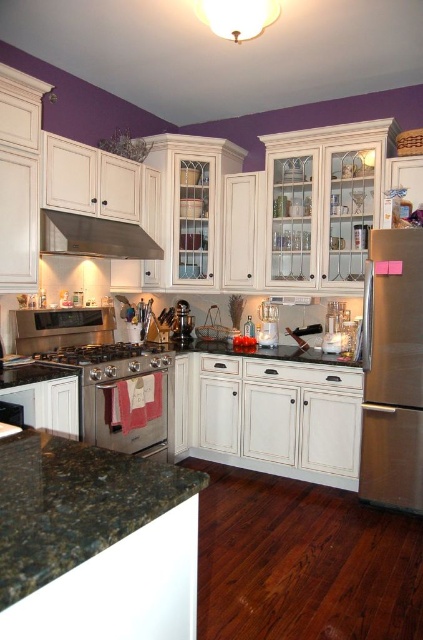
Question: Estimate the real-world distances between objects in this image. Which object is closer to the stainless steel stove at center?

Choices:
 (A) stainless steel refrigerator at right
 (B) granite countertop at center
 (C) stainless steel exhaust hood at upper center
 (D) green granite countertop at lower left

Answer: (B)

Question: Does stainless steel oven at center appear on the left side of satin silver blender at center?

Choices:
 (A) no
 (B) yes

Answer: (B)

Question: Among these objects, which one is nearest to the camera?

Choices:
 (A) stainless steel oven at center
 (B) green granite countertop at lower left
 (C) satin silver blender at center

Answer: (B)

Question: Does stainless steel oven at center have a smaller size compared to stainless steel stove at center?

Choices:
 (A) yes
 (B) no

Answer: (B)

Question: Can you confirm if satin silver blender at center is smaller than brushed metal coffee pot at center?

Choices:
 (A) yes
 (B) no

Answer: (B)

Question: Which point appears closest to the camera in this image?

Choices:
 (A) (126, 397)
 (B) (151, 257)

Answer: (A)